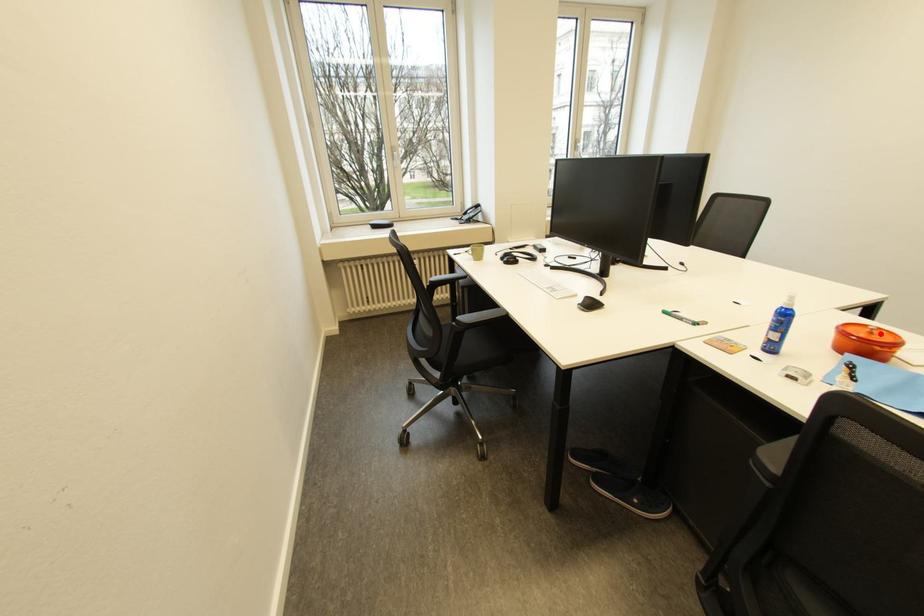
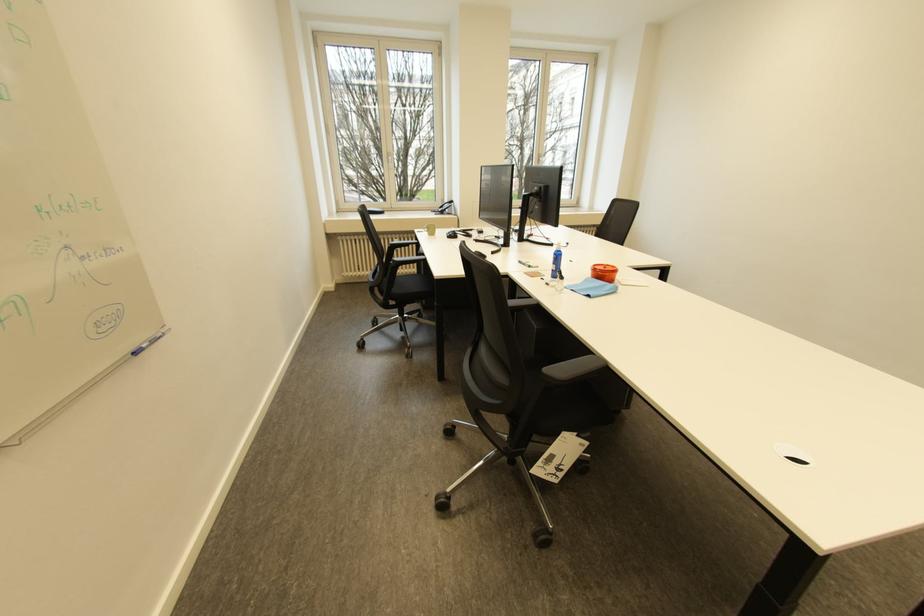
Locate, in the second image, the point that corresponds to the highlighted location in the first image.

(614, 268)